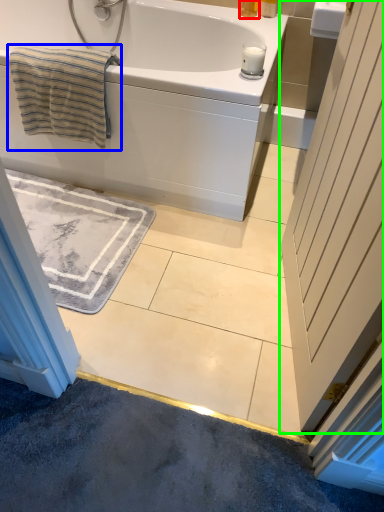
Question: Estimate the real-world distances between objects in this image. Which object is farther from toiletry (highlighted by a red box), beach towel (highlighted by a blue box) or door (highlighted by a green box)?

Choices:
 (A) beach towel
 (B) door

Answer: (B)